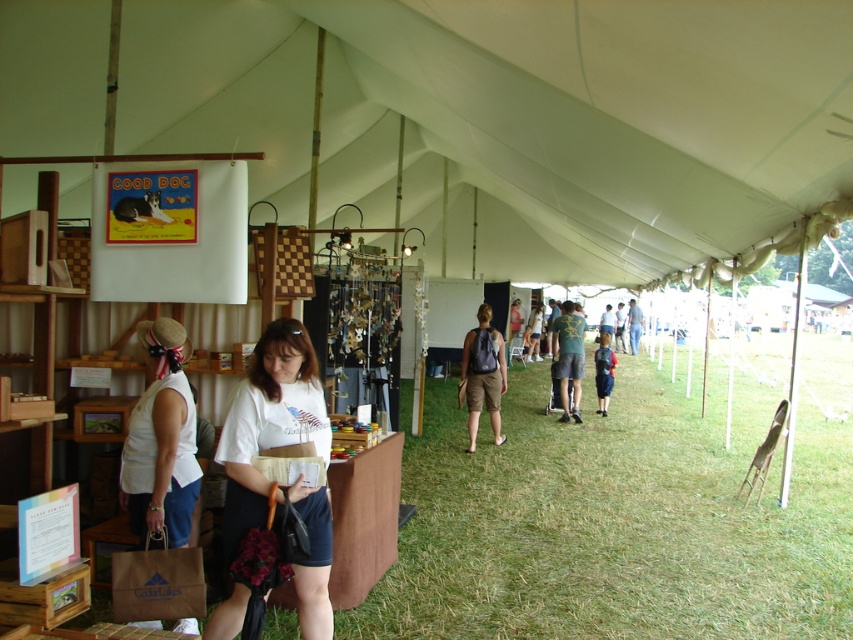
Is point (314, 513) positioned in front of point (485, 390)?

Yes.

At what (x,y) coordinates should I click in order to perform the action: click on white cotton shirt at center. Please return your answer as a coordinate pair (x, y). The height and width of the screenshot is (640, 853). Looking at the image, I should click on (268, 422).

Is the position of white fabric canopy at upper left less distant than that of green grass at center?

Yes.

Between white fabric canopy at upper left and green grass at center, which one has more height?

With more height is white fabric canopy at upper left.

The image size is (853, 640). Describe the element at coordinates (515, 116) in the screenshot. I see `white fabric canopy at upper left` at that location.

Locate an element on the screen. white fabric canopy at upper left is located at coordinates (515, 116).

Does white fabric canopy at upper left have a greater height compared to white cotton shirt at center?

Yes, white fabric canopy at upper left is taller than white cotton shirt at center.

Locate an element on the screen. This screenshot has height=640, width=853. white fabric canopy at upper left is located at coordinates (515, 116).

Where is `white fabric canopy at upper left`? white fabric canopy at upper left is located at coordinates (515, 116).